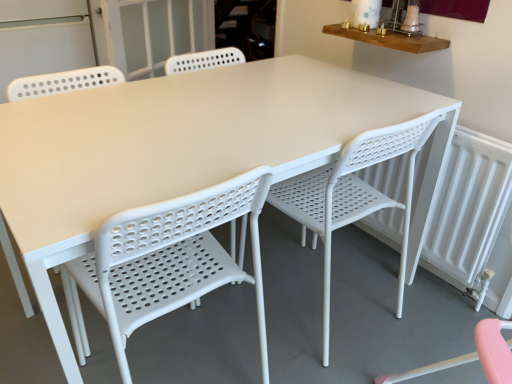
Locate an element on the screen. The width and height of the screenshot is (512, 384). free space in front of white plastic radiator at right is located at coordinates (402, 319).